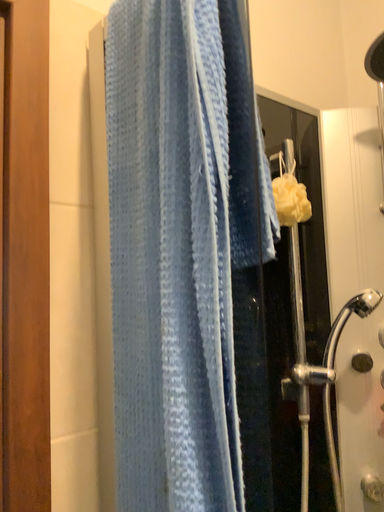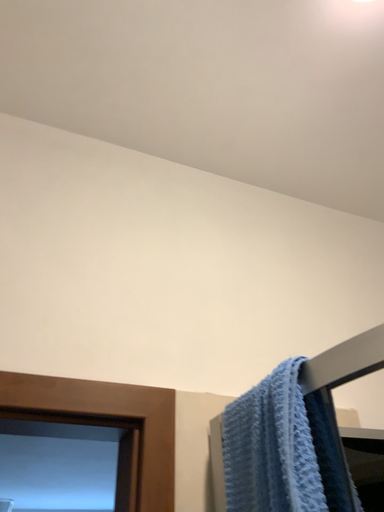
Question: How did the camera likely rotate when shooting the video?

Choices:
 (A) rotated upward
 (B) rotated downward

Answer: (A)